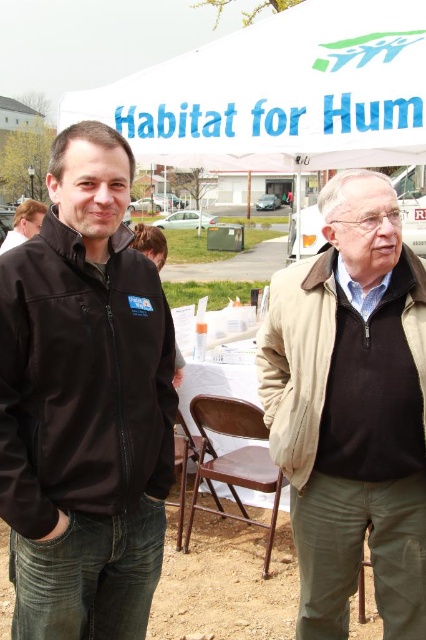
Based on the scene description, where is the beige fabric jacket at right located in terms of its 2D coordinates?

The beige fabric jacket at right is located at the 2D coordinates of point (296,360).

You are a photographer taking a picture of the two men under the canopy. You notice the beige fabric jacket at right and the matte black jacket at center. Which jacket will appear closer to the camera in the photo?

The beige fabric jacket at right is in front of the matte black jacket at center, so it will appear closer to the camera in the photo.

You are standing at a point 1.81 meters away from the point marked as point (115, 317). If you want to move closer to that point, which direction should you move?

Since the point (115, 317) is 1.81 meters away from you, you should move forward towards it to get closer.